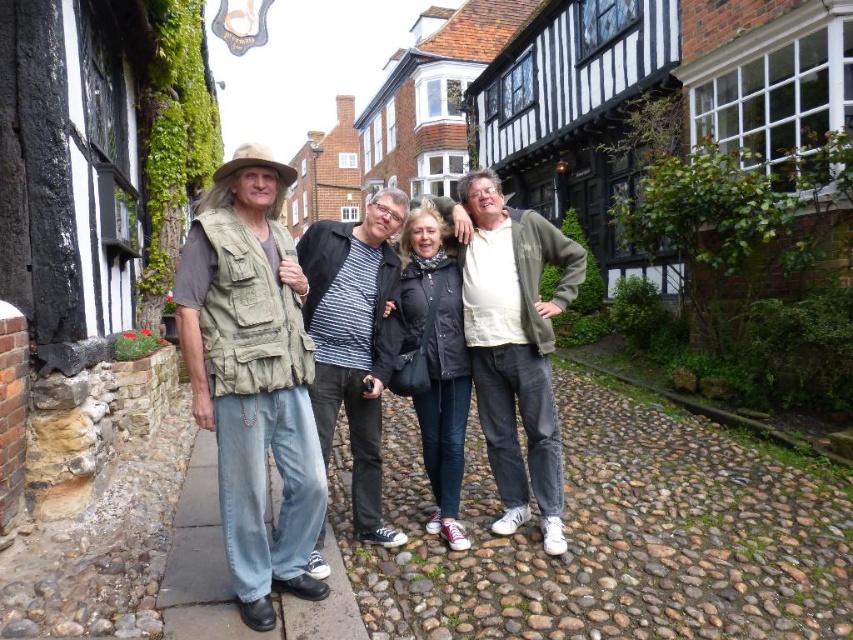
Question: Which is farther from the matte black jacket at center?

Choices:
 (A) denim jeans at center
 (B) black leather jacket at center

Answer: (B)

Question: Can you confirm if denim jeans at center is positioned below matte black jacket at center?

Choices:
 (A) yes
 (B) no

Answer: (B)

Question: Can you confirm if denim jeans at center is smaller than black leather jacket at center?

Choices:
 (A) no
 (B) yes

Answer: (B)

Question: Which object is the farthest from the denim jeans at center?

Choices:
 (A) black leather jacket at center
 (B) matte black jacket at center

Answer: (A)

Question: Which point is farther to the camera?

Choices:
 (A) (375, 502)
 (B) (252, 378)

Answer: (A)

Question: Where is denim jeans at center located in relation to matte black jacket at center in the image?

Choices:
 (A) above
 (B) below

Answer: (A)